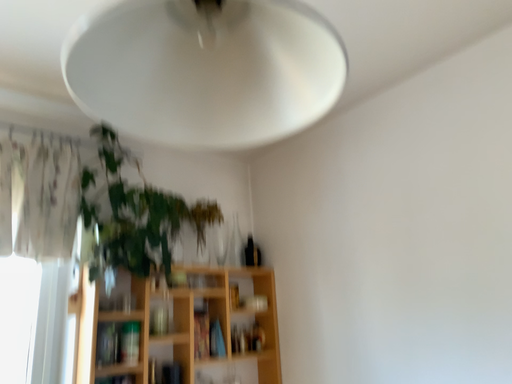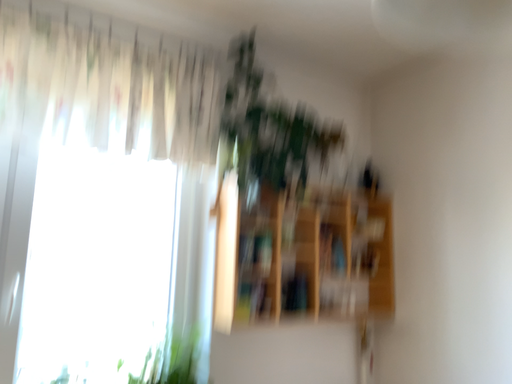
Question: How did the camera likely rotate when shooting the video?

Choices:
 (A) rotated upward
 (B) rotated downward

Answer: (B)